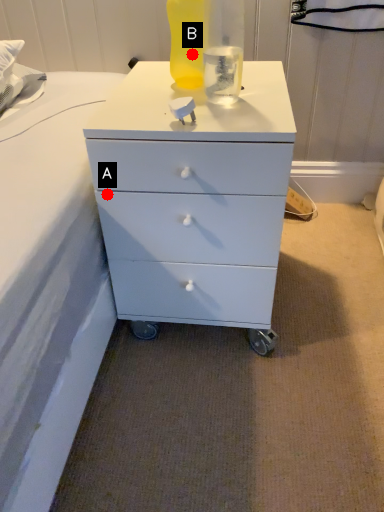
Question: Two points are circled on the image, labeled by A and B beside each circle. Which point appears farthest from the camera in this image?

Choices:
 (A) A is further
 (B) B is further

Answer: (B)